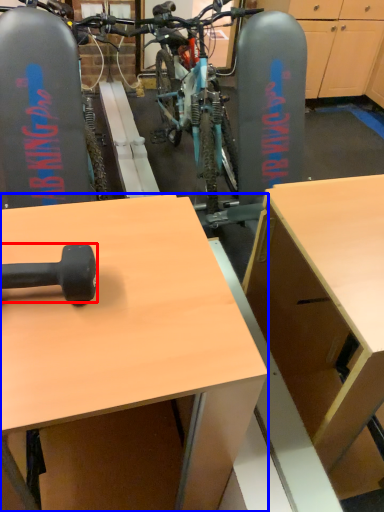
Question: Among these objects, which one is nearest to the camera, dumbbell (highlighted by a red box) or desk (highlighted by a blue box)?

Choices:
 (A) dumbbell
 (B) desk

Answer: (B)